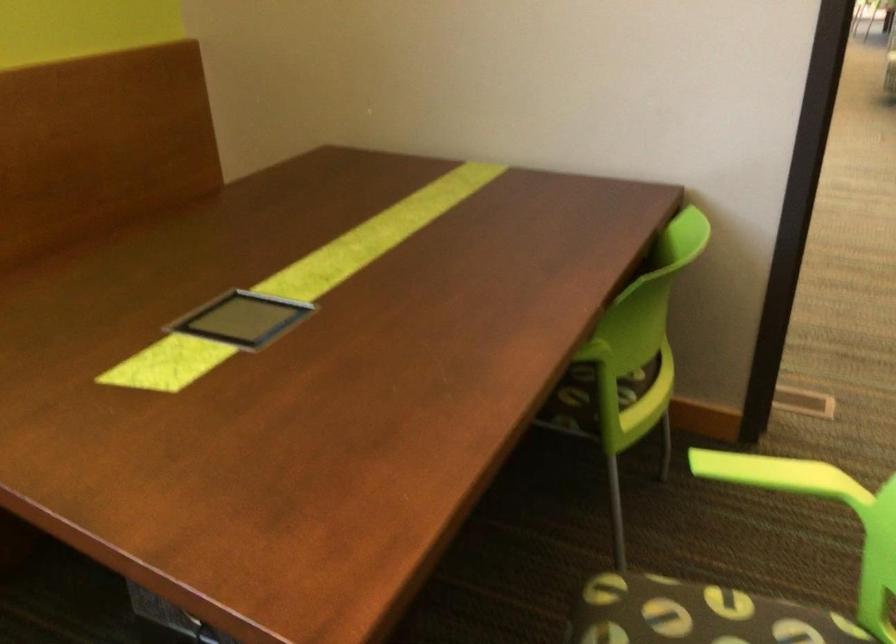
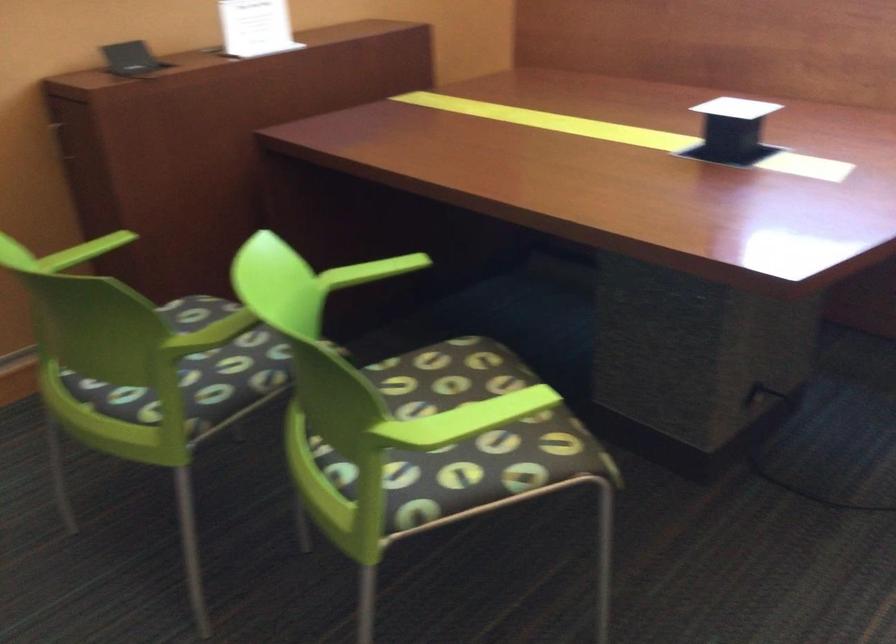
The first image is from the beginning of the video and the second image is from the end. How did the camera likely rotate when shooting the video?

The rotation direction of the camera is left-down.